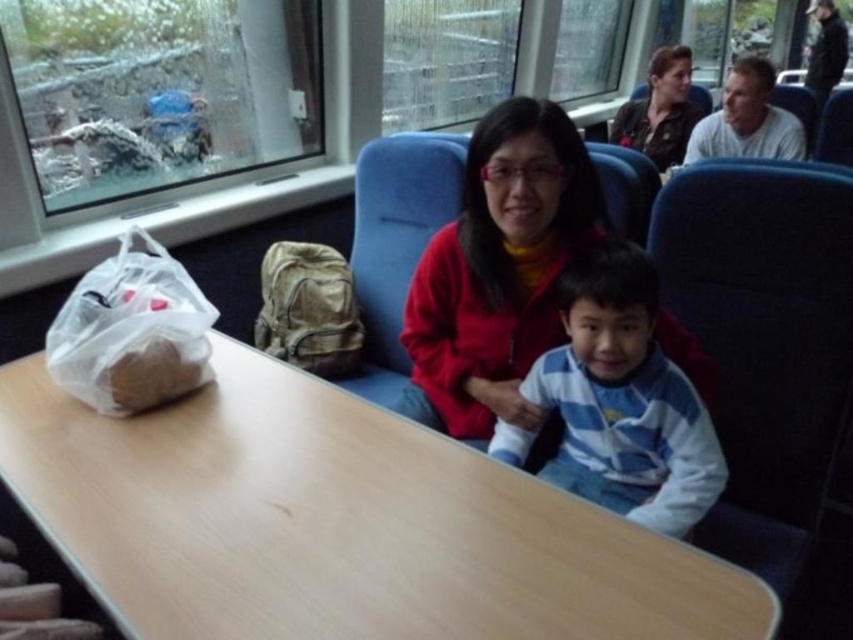
Is blue striped sweater at center to the right of camouflage fabric backpack at center from the viewer's perspective?

Yes, blue striped sweater at center is to the right of camouflage fabric backpack at center.

Does blue striped sweater at center appear on the left side of camouflage fabric backpack at center?

Incorrect, blue striped sweater at center is not on the left side of camouflage fabric backpack at center.

The image size is (853, 640). I want to click on blue striped sweater at center, so click(624, 400).

Who is positioned more to the right, matte red jacket at center or white cotton shirt at upper right?

white cotton shirt at upper right

Find the location of a particular element. matte red jacket at center is located at coordinates (498, 273).

Who is shorter, matte red jacket at center or matte black jacket at upper center?

matte black jacket at upper center

How much distance is there between matte red jacket at center and matte black jacket at upper center?

They are 1.91 meters apart.

At what (x,y) coordinates should I click in order to perform the action: click on matte red jacket at center. Please return your answer as a coordinate pair (x, y). This screenshot has height=640, width=853. Looking at the image, I should click on (498, 273).

I want to click on matte red jacket at center, so click(x=498, y=273).